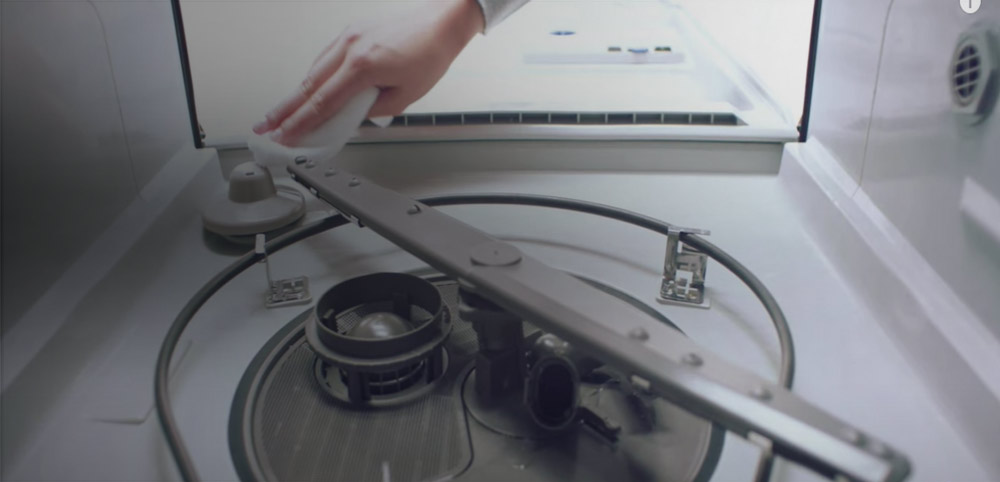
Find the location of a particular element. This screenshot has width=1000, height=482. left side of dishwasher panel is located at coordinates 66,87.